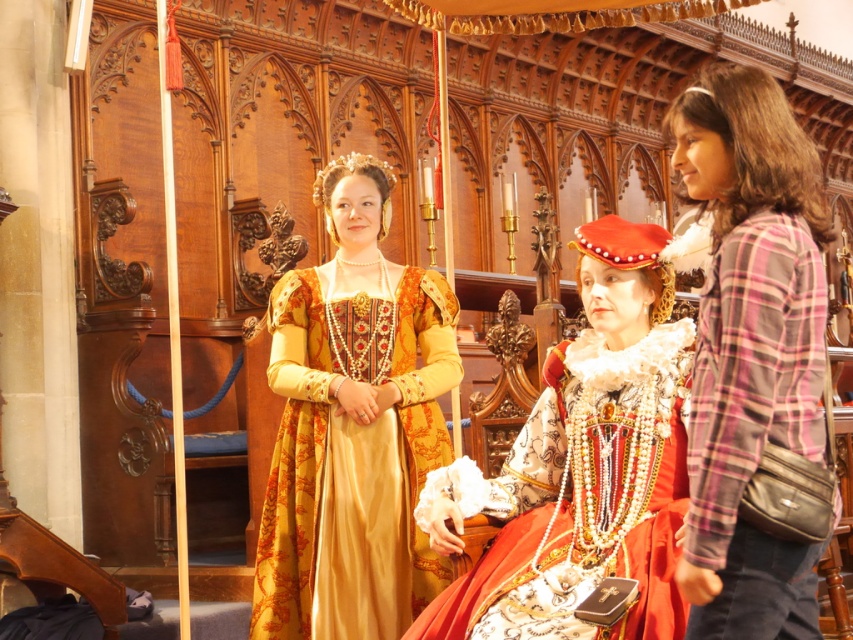
Question: Is plaid fabric shirt at right behind matte red velvet dress at center?

Choices:
 (A) yes
 (B) no

Answer: (B)

Question: Which object is the closest to the plaid fabric shirt at right?

Choices:
 (A) matte red velvet dress at center
 (B) golden silk gown at center

Answer: (A)

Question: Among these objects, which one is nearest to the camera?

Choices:
 (A) matte red velvet dress at center
 (B) golden silk gown at center
 (C) plaid fabric shirt at right

Answer: (C)

Question: Which point is farther to the camera?

Choices:
 (A) (421, 401)
 (B) (671, 440)

Answer: (A)

Question: Does golden silk gown at center come behind matte red velvet dress at center?

Choices:
 (A) yes
 (B) no

Answer: (A)

Question: Is golden silk gown at center positioned in front of matte red velvet dress at center?

Choices:
 (A) yes
 (B) no

Answer: (B)